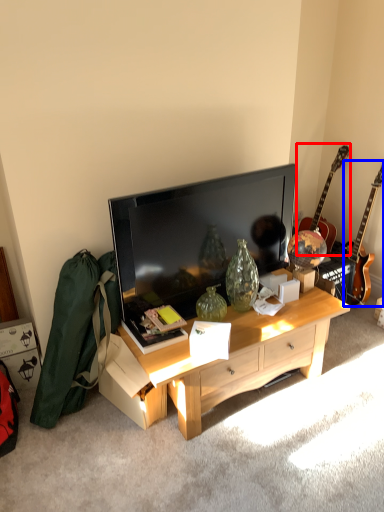
Question: Among these objects, which one is farthest to the camera, guitar (highlighted by a red box) or guitar (highlighted by a blue box)?

Choices:
 (A) guitar
 (B) guitar

Answer: (A)